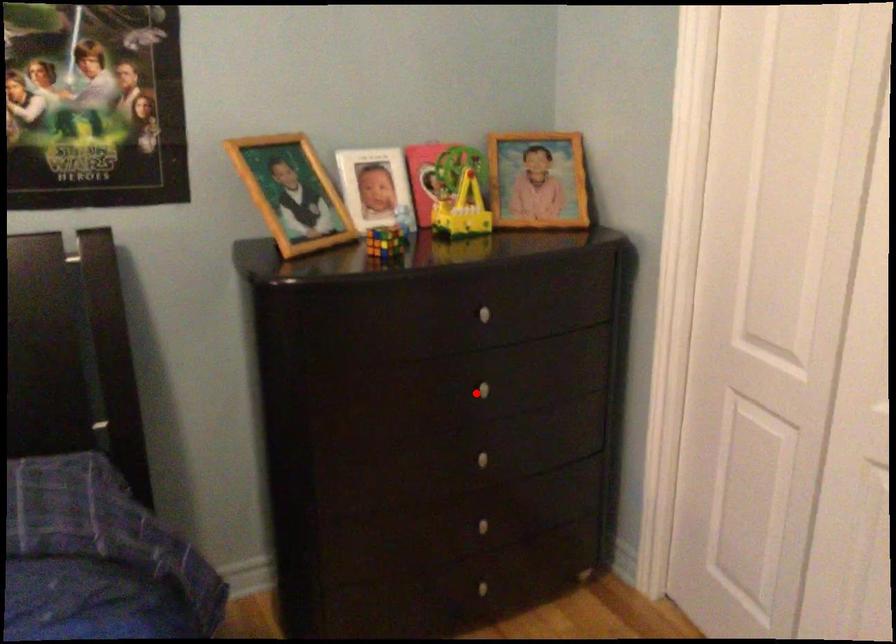
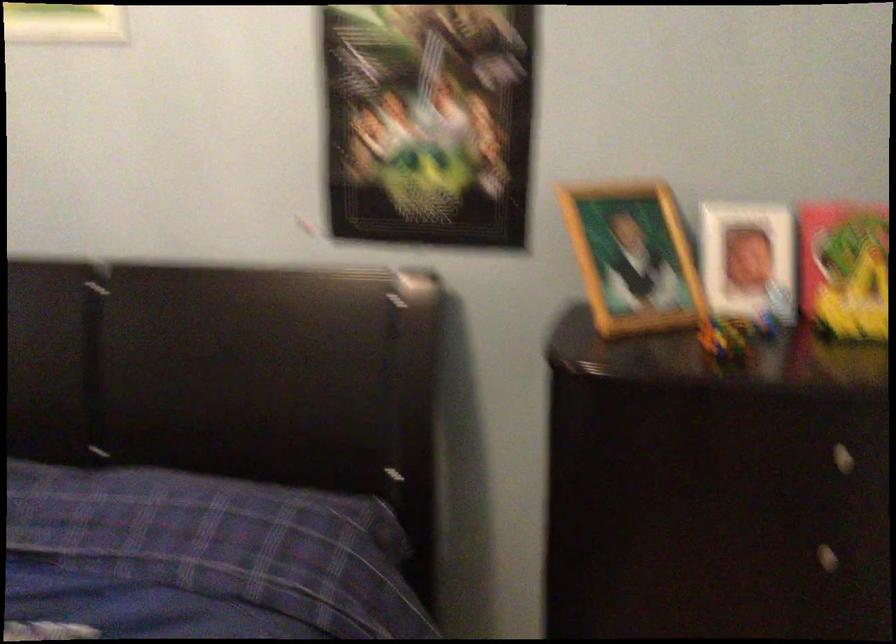
Where in the second image is the point corresponding to the highlighted location from the first image?

(807, 554)